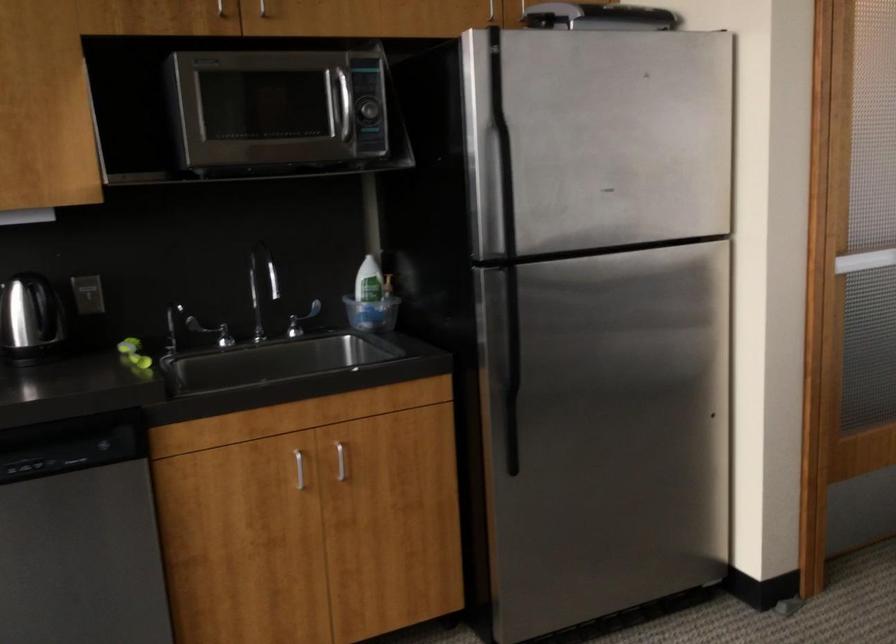
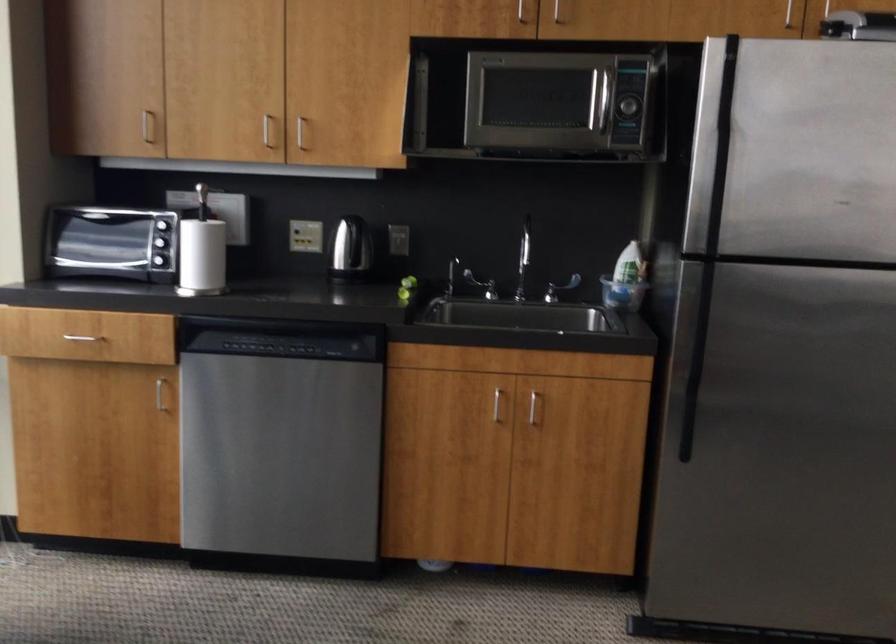
Find the pixel in the second image that matches point 202,332 in the first image.

(480, 285)